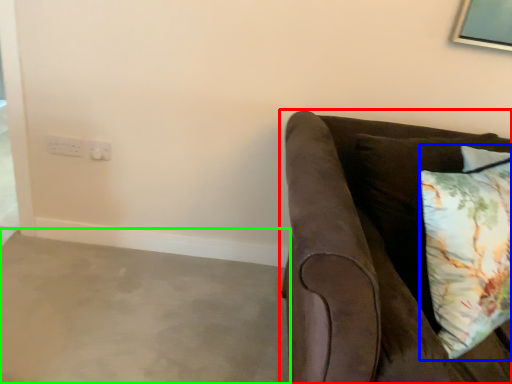
Question: Estimate the real-world distances between objects in this image. Which object is closer to studio couch (highlighted by a red box), pillow (highlighted by a blue box) or concrete (highlighted by a green box)?

Choices:
 (A) pillow
 (B) concrete

Answer: (A)